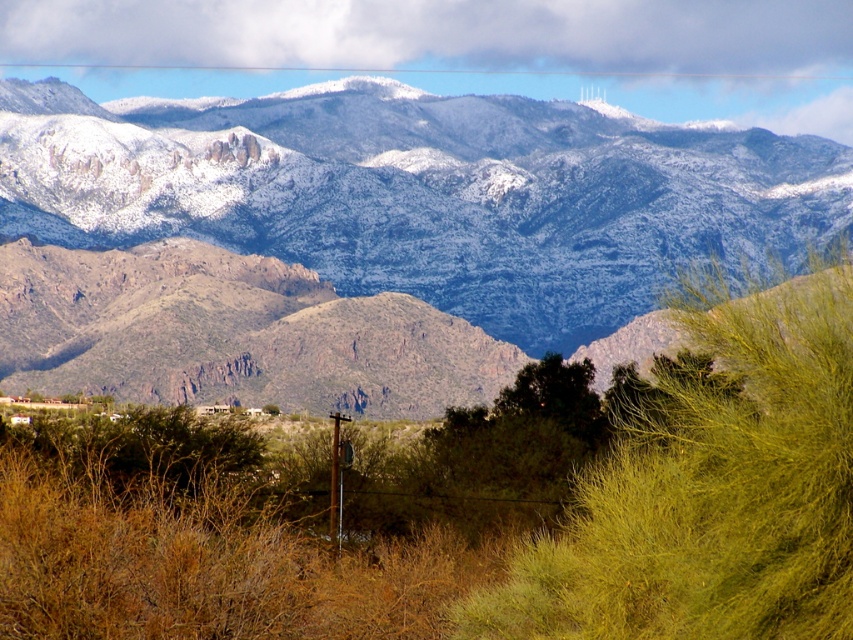
Question: Among these points, which one is nearest to the camera?

Choices:
 (A) (132, 164)
 (B) (695, 531)

Answer: (B)

Question: Is snow-covered mountains at upper center positioned at the back of green leafy bush at center?

Choices:
 (A) yes
 (B) no

Answer: (A)

Question: Does snow-covered mountains at upper center have a smaller size compared to green leafy bush at center?

Choices:
 (A) no
 (B) yes

Answer: (A)

Question: Is snow-covered mountains at upper center to the left of green leafy bush at center from the viewer's perspective?

Choices:
 (A) yes
 (B) no

Answer: (A)

Question: Which of the following is the closest to the observer?

Choices:
 (A) snow-covered mountains at upper center
 (B) green leafy bush at center

Answer: (B)